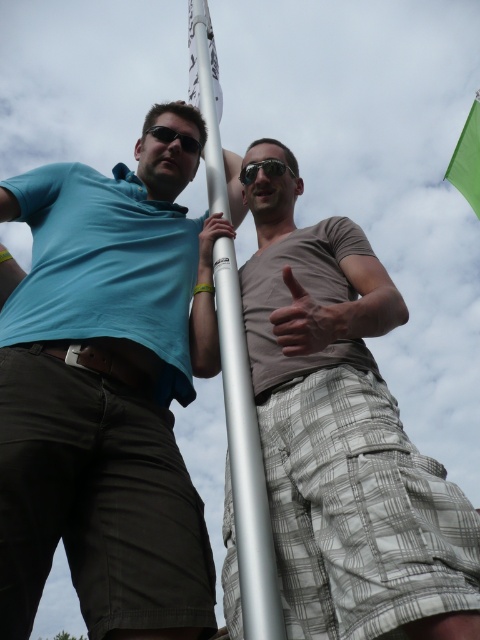
You are a photographer trying to capture both the silver metallic pole at center and the green fabric flag at upper right in a single frame. Given their sizes, which object should you focus on to ensure both are visible without cropping?

Since the silver metallic pole at center is smaller in size compared to the green fabric flag at upper right, you should focus on the silver metallic pole at center to ensure both are visible without cropping.

You are standing at the base of the pole and want to reach the top. There are two points marked on the pole, point A at coordinates point (x=470, y=163) and point B at coordinates point (x=294, y=176). Which point is closer to you?

Point A at coordinates point (x=470, y=163) is closer to you because it is further to the viewer than point B at coordinates point (x=294, y=176).